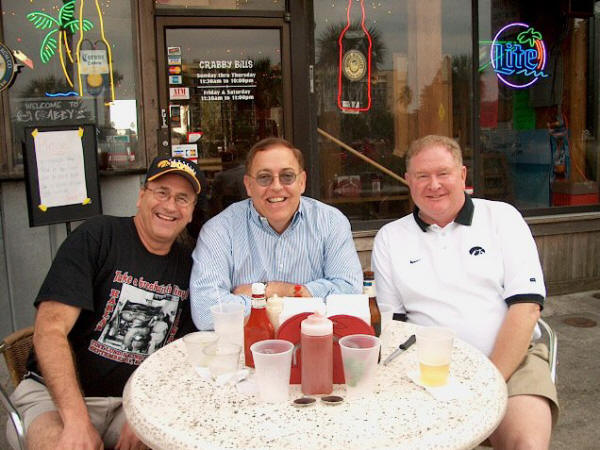
This screenshot has width=600, height=450. I want to click on cups, so click(x=433, y=337), click(x=360, y=354), click(x=280, y=359), click(x=228, y=370), click(x=196, y=343), click(x=227, y=312).